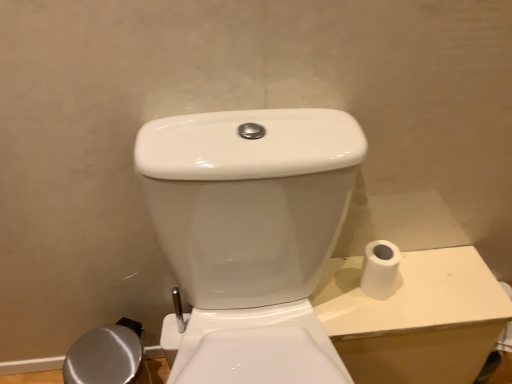
The image size is (512, 384). Find the location of `blank space above white glossy porcelain at right (from a real-world perspective)`. blank space above white glossy porcelain at right (from a real-world perspective) is located at coordinates (407, 279).